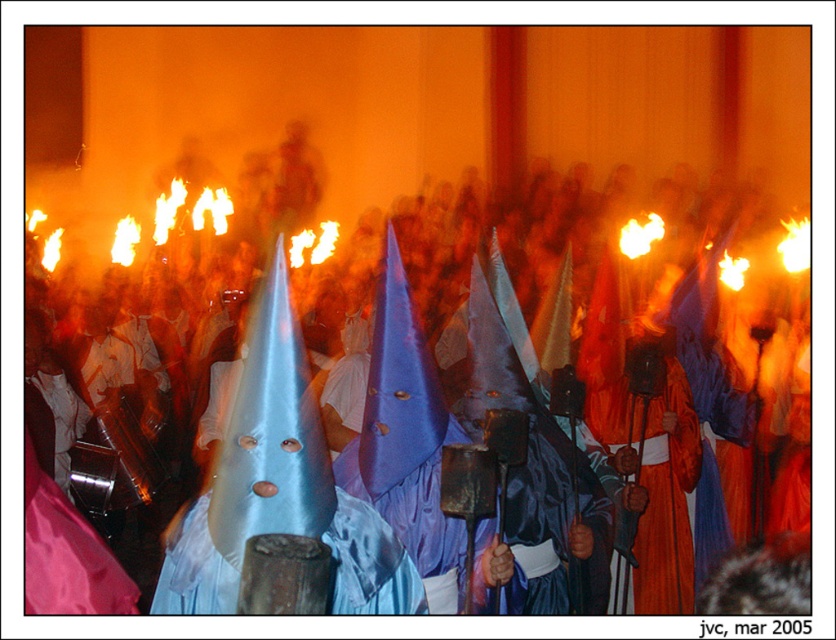
Question: Which point is farther to the camera?

Choices:
 (A) satin blue cone at center
 (B) orange satin robe at center

Answer: (B)

Question: Does satin blue cone at center have a smaller size compared to orange satin robe at center?

Choices:
 (A) no
 (B) yes

Answer: (B)

Question: Does satin blue cone at center have a greater width compared to orange satin robe at center?

Choices:
 (A) yes
 (B) no

Answer: (B)

Question: Is satin blue cone at center further to the viewer compared to orange satin robe at center?

Choices:
 (A) yes
 (B) no

Answer: (B)

Question: Which point is farther to the camera?

Choices:
 (A) orange satin robe at center
 (B) satin blue cone at center

Answer: (A)

Question: Which object is closer to the camera taking this photo?

Choices:
 (A) satin blue cone at center
 (B) orange satin robe at center

Answer: (A)